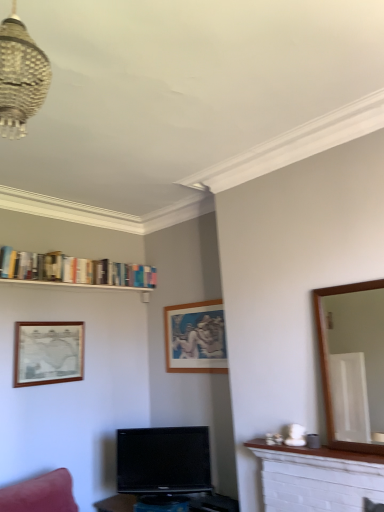
Question: Can you confirm if black glossy tv at center is positioned to the right of white brick fireplace at lower right?

Choices:
 (A) yes
 (B) no

Answer: (B)

Question: Considering the relative sizes of black glossy tv at center and white brick fireplace at lower right in the image provided, is black glossy tv at center taller than white brick fireplace at lower right?

Choices:
 (A) yes
 (B) no

Answer: (A)

Question: Is black glossy tv at center not inside white brick fireplace at lower right?

Choices:
 (A) no
 (B) yes

Answer: (B)

Question: Considering the relative sizes of black glossy tv at center and white brick fireplace at lower right in the image provided, is black glossy tv at center wider than white brick fireplace at lower right?

Choices:
 (A) no
 (B) yes

Answer: (B)

Question: Considering the relative sizes of black glossy tv at center and white brick fireplace at lower right in the image provided, is black glossy tv at center shorter than white brick fireplace at lower right?

Choices:
 (A) no
 (B) yes

Answer: (A)

Question: Considering the positions of white marble mantle at lower right and white brick fireplace at lower right in the image, is white marble mantle at lower right bigger or smaller than white brick fireplace at lower right?

Choices:
 (A) small
 (B) big

Answer: (A)

Question: In the image, is white marble mantle at lower right positioned in front of or behind white brick fireplace at lower right?

Choices:
 (A) front
 (B) behind

Answer: (B)

Question: Looking at their shapes, would you say white marble mantle at lower right is wider or thinner than white brick fireplace at lower right?

Choices:
 (A) thin
 (B) wide

Answer: (B)

Question: Is point (322, 446) positioned closer to the camera than point (360, 465)?

Choices:
 (A) closer
 (B) farther

Answer: (B)

Question: In terms of width, does white brick fireplace at lower right look wider or thinner when compared to hardcover books at upper left?

Choices:
 (A) thin
 (B) wide

Answer: (A)

Question: Is white brick fireplace at lower right bigger or smaller than hardcover books at upper left?

Choices:
 (A) small
 (B) big

Answer: (A)

Question: Is point (357, 502) closer or farther from the camera than point (139, 269)?

Choices:
 (A) closer
 (B) farther

Answer: (A)

Question: Relative to hardcover books at upper left, is white brick fireplace at lower right in front or behind?

Choices:
 (A) behind
 (B) front

Answer: (B)

Question: Is black glossy tv at center situated inside wooden picture frame at left, which is the 1th picture frame in left-to-right order, or outside?

Choices:
 (A) inside
 (B) outside

Answer: (B)

Question: From a real-world perspective, is black glossy tv at center physically located above or below wooden picture frame at left, arranged as the 2th picture frame when viewed from the right?

Choices:
 (A) below
 (B) above

Answer: (A)